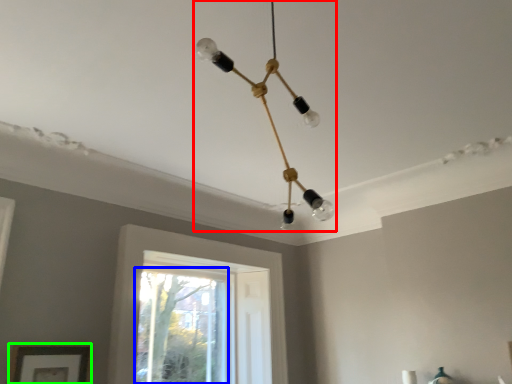
Question: Which is nearer to the lamp (highlighted by a red box)? window (highlighted by a blue box) or picture frame (highlighted by a green box).

Choices:
 (A) window
 (B) picture frame

Answer: (B)